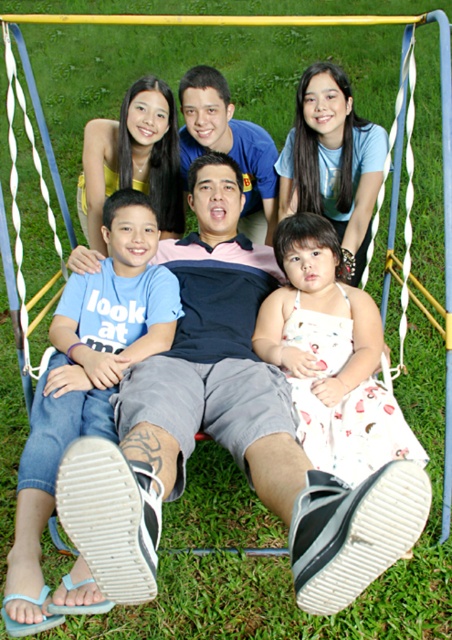
You are a photographer trying to capture a photo of the blue cotton shirt at lower left and the white floral dress at center. Which one should you focus on first if you want to ensure both are in focus without adjusting the camera settings?

The blue cotton shirt at lower left has a greater height compared to the white floral dress at center, so focusing on the blue cotton shirt at lower left first would ensure both are in focus since it is taller and likely closer to the camera.

What is the exact position of the blue cotton shirt at lower left in the image?

The blue cotton shirt at lower left is located at point (86, 380).